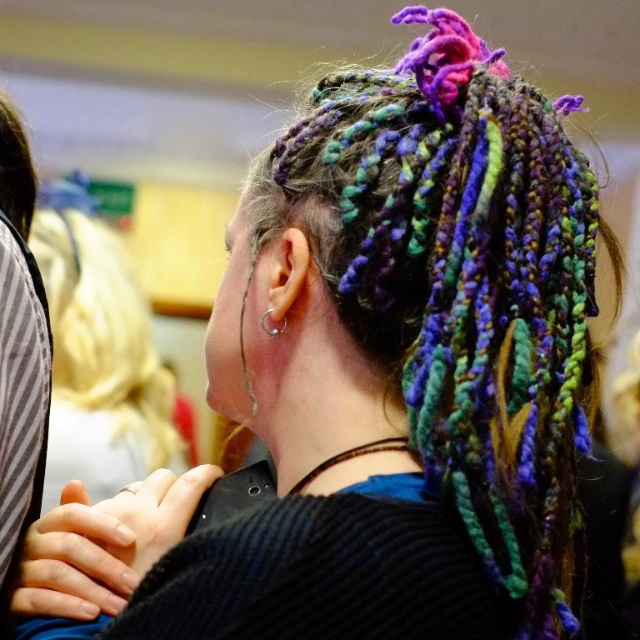
You are a photographer adjusting your camera to focus on two specific points on the person in the image. The points are labeled as point (61, 340) and point (268, 321). Which point is closer to your camera lens?

Point (61, 340) is closer to the camera lens because it is further to the viewer than point (268, 321).